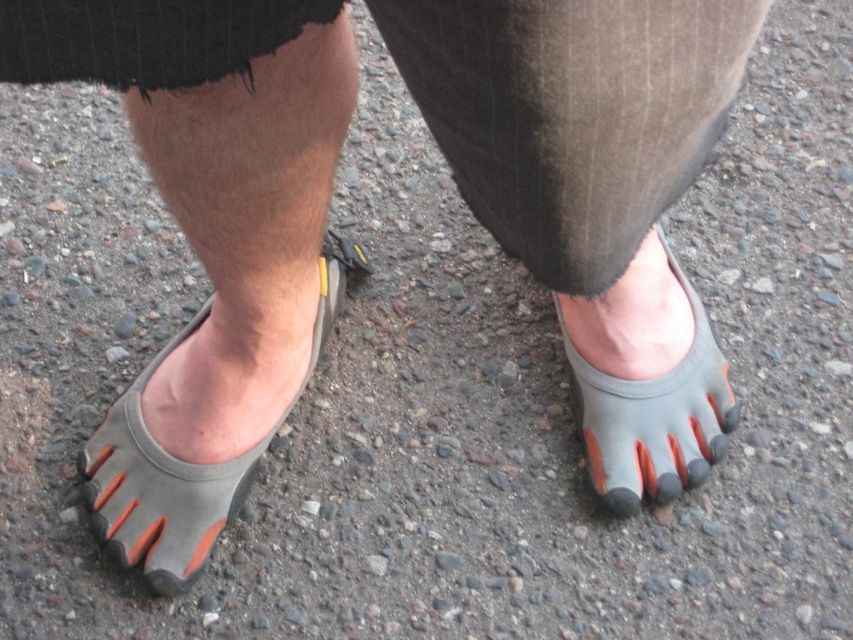
You are designing a shoe display stand for the gray rubber toe shoe at center and the orange rubber toe at center. If the stand has two slots with the same width, which shoe will not fit properly?

The gray rubber toe shoe at center will not fit properly because its width is larger than the orange rubber toe at center, so it may not fit into the same width slots.

Based on the photo, you are a photographer trying to capture the gray rubber toe shoe at center in the image. The camera is positioned at point A, and you need to adjust the focus to ensure the shoe is sharp. Given the coordinates of the shoe at point B, which is at the center of the image, will the shoe be in focus if you focus on point B?

Yes, the gray rubber toe shoe at center is located at point B, so focusing on point B will ensure the shoe is in focus.